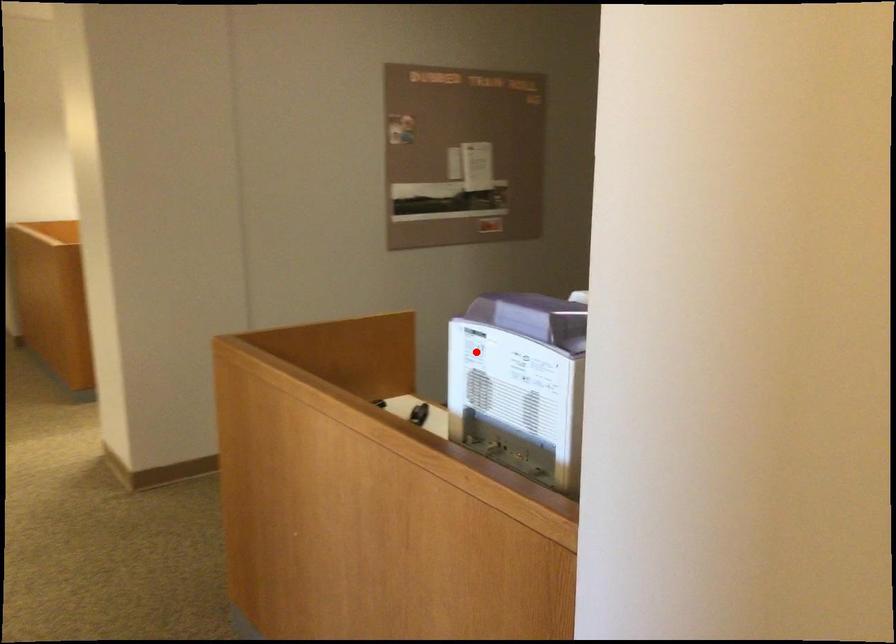
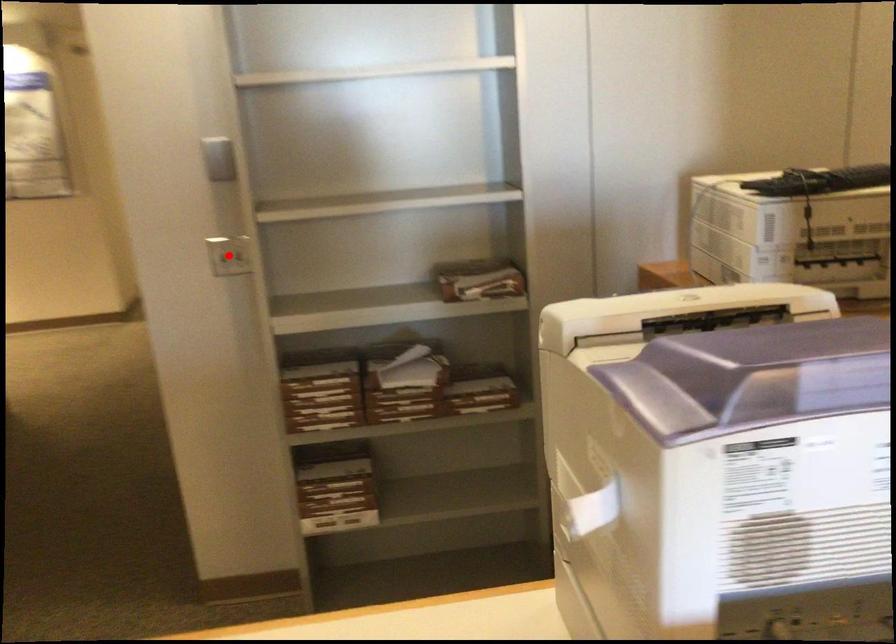
I am providing you with two images of the same scene from different viewpoints. A red point is marked on the first image and another point is marked on the second image. Do the highlighted points in image1 and image2 indicate the same real-world spot?

No